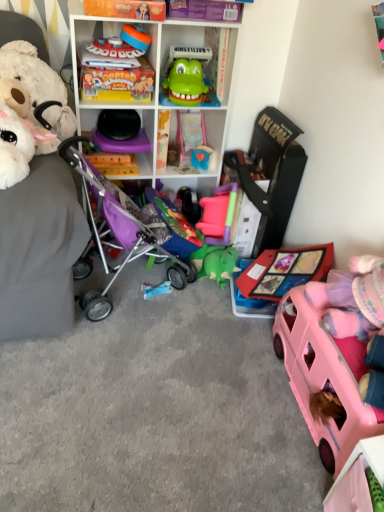
Question: From the image's perspective, does purple fabric baby carriage at left appear higher than fluffy white teddy bear at left, the 7th toy positioned from the right?

Choices:
 (A) no
 (B) yes

Answer: (A)

Question: Can you confirm if purple fabric baby carriage at left is positioned to the right of fluffy white teddy bear at left, the 7th toy positioned from the right?

Choices:
 (A) yes
 (B) no

Answer: (A)

Question: Is purple fabric baby carriage at left positioned beyond the bounds of fluffy white teddy bear at left, the 7th toy positioned from the right?

Choices:
 (A) no
 (B) yes

Answer: (B)

Question: Is purple fabric baby carriage at left surrounding fluffy white teddy bear at left, which appears as the 1th toy when viewed from the left?

Choices:
 (A) no
 (B) yes

Answer: (A)

Question: Is purple fabric baby carriage at left far from fluffy white teddy bear at left, the 7th toy positioned from the right?

Choices:
 (A) no
 (B) yes

Answer: (A)

Question: Is purple fabric baby carriage at left closer to the viewer compared to fluffy white teddy bear at left, the 7th toy positioned from the right?

Choices:
 (A) no
 (B) yes

Answer: (A)

Question: Does purple fabric baby carriage at left have a lesser height compared to white plastic shelf at upper center?

Choices:
 (A) no
 (B) yes

Answer: (B)

Question: Can you confirm if purple fabric baby carriage at left is thinner than white plastic shelf at upper center?

Choices:
 (A) yes
 (B) no

Answer: (B)

Question: Is purple fabric baby carriage at left positioned beyond the bounds of white plastic shelf at upper center?

Choices:
 (A) no
 (B) yes

Answer: (B)

Question: Can you confirm if purple fabric baby carriage at left is smaller than white plastic shelf at upper center?

Choices:
 (A) yes
 (B) no

Answer: (A)

Question: Considering the relative sizes of purple fabric baby carriage at left and white plastic shelf at upper center in the image provided, is purple fabric baby carriage at left taller than white plastic shelf at upper center?

Choices:
 (A) no
 (B) yes

Answer: (A)

Question: Considering the relative sizes of purple fabric baby carriage at left and white plastic shelf at upper center in the image provided, is purple fabric baby carriage at left wider than white plastic shelf at upper center?

Choices:
 (A) yes
 (B) no

Answer: (A)

Question: Is pink plastic car at lower right, positioned as the 7th toy in left-to-right order, at the back of blue matte toy at center, the second toy viewed from the right?

Choices:
 (A) yes
 (B) no

Answer: (B)